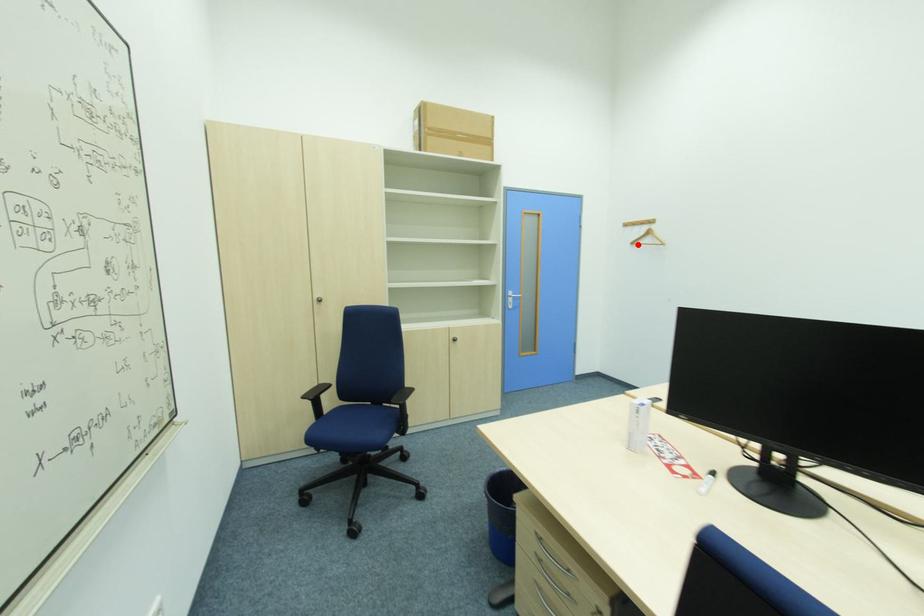
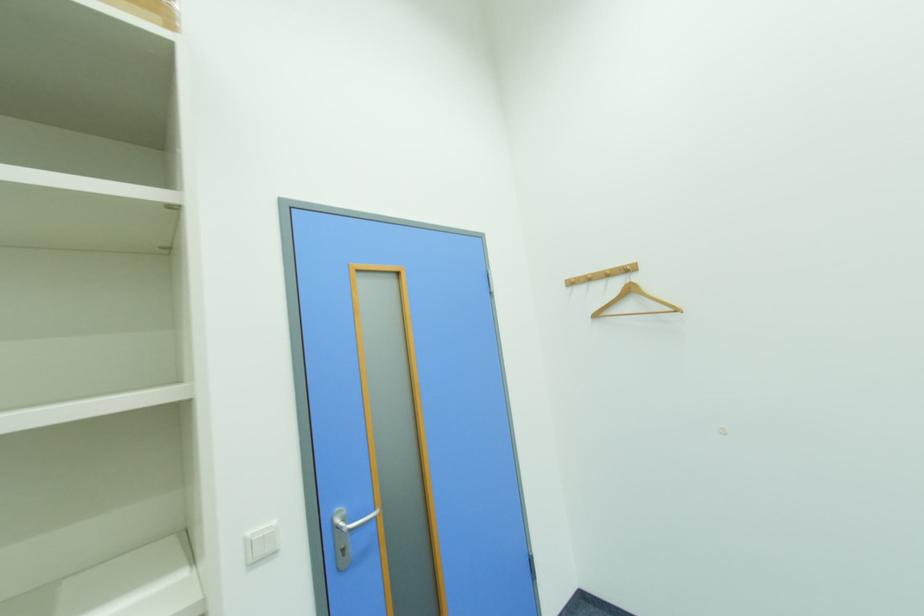
The point at the highlighted location is marked in the first image. Where is the corresponding point in the second image?

(601, 317)